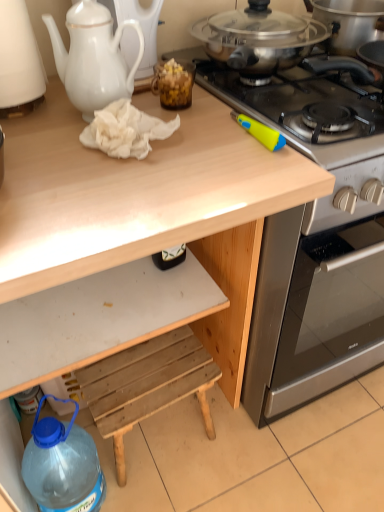
Identify the location of vacant area on top of wooden step stool at lower center (from a real-world perspective). The image size is (384, 512). (146, 372).